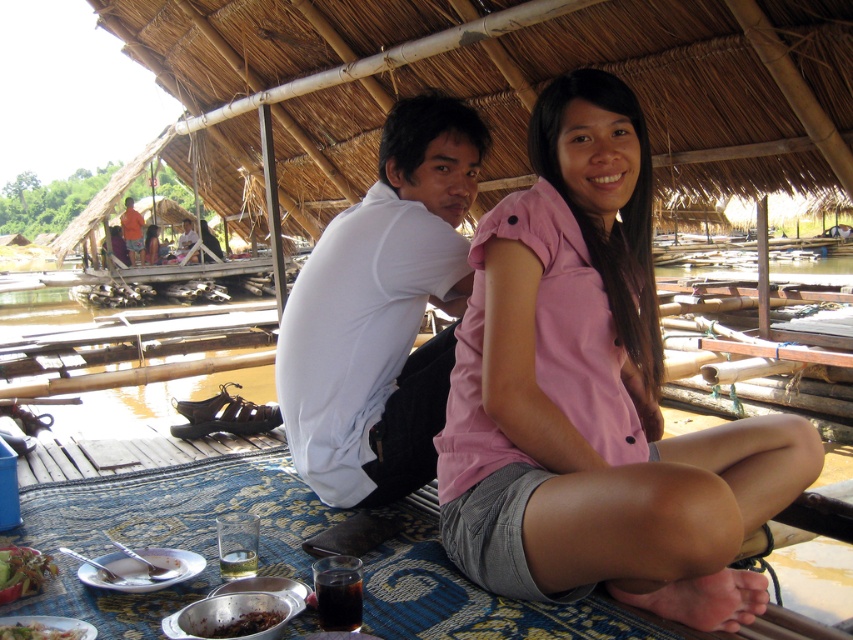
You are a food delivery person who needs to place a new order between the green leafy vegetables at lower left and the green leafy salad at lower left. Which one should you place closer to the edge of the table to ensure it fits better?

The green leafy vegetables at lower left has a lesser width compared to green leafy salad at lower left, so you should place the green leafy salad at lower left closer to the edge of the table to accommodate its wider size.